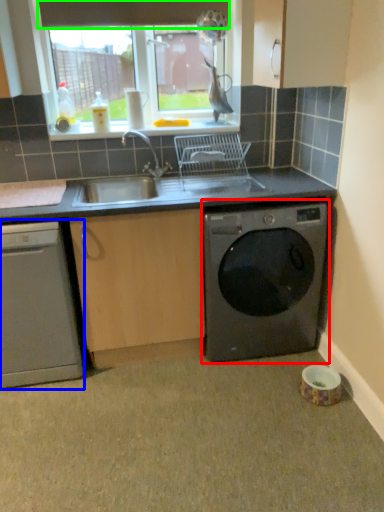
Question: Which object is the closest to the washing machine (highlighted by a red box)? Choose among these: dishwasher (highlighted by a blue box) or exhaust hood (highlighted by a green box).

Choices:
 (A) dishwasher
 (B) exhaust hood

Answer: (A)